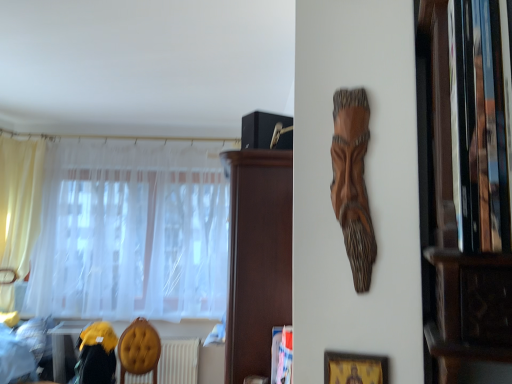
Question: Is yellow sheer curtain at left, which is the second curtain in right-to-left order, not within yellow fabric armchair at lower left?

Choices:
 (A) yes
 (B) no

Answer: (A)

Question: From the image's perspective, is yellow sheer curtain at left, which appears as the 1th curtain when viewed from the left, beneath yellow fabric armchair at lower left?

Choices:
 (A) no
 (B) yes

Answer: (A)

Question: Is yellow sheer curtain at left, which is the second curtain in right-to-left order, oriented towards yellow fabric armchair at lower left?

Choices:
 (A) no
 (B) yes

Answer: (A)

Question: Is yellow sheer curtain at left, which is the second curtain in right-to-left order, bigger than yellow fabric armchair at lower left?

Choices:
 (A) yes
 (B) no

Answer: (A)

Question: Would you consider yellow sheer curtain at left, which appears as the 1th curtain when viewed from the left, to be distant from yellow fabric armchair at lower left?

Choices:
 (A) no
 (B) yes

Answer: (B)

Question: In terms of width, does wooden carving at upper center look wider or thinner when compared to velvet yellow swivel chair at lower left?

Choices:
 (A) thin
 (B) wide

Answer: (A)

Question: Is wooden carving at upper center bigger or smaller than velvet yellow swivel chair at lower left?

Choices:
 (A) big
 (B) small

Answer: (B)

Question: Is wooden carving at upper center taller or shorter than velvet yellow swivel chair at lower left?

Choices:
 (A) short
 (B) tall

Answer: (A)

Question: From a real-world perspective, is wooden carving at upper center positioned above or below velvet yellow swivel chair at lower left?

Choices:
 (A) above
 (B) below

Answer: (A)

Question: Relative to white sheer curtain at left, arranged as the 2th curtain when viewed from the left, is wooden carving at upper center in front or behind?

Choices:
 (A) front
 (B) behind

Answer: (A)

Question: Is wooden carving at upper center inside or outside of white sheer curtain at left, arranged as the 2th curtain when viewed from the left?

Choices:
 (A) inside
 (B) outside

Answer: (B)

Question: From their relative heights in the image, would you say wooden carving at upper center is taller or shorter than white sheer curtain at left, the 1th curtain positioned from the right?

Choices:
 (A) short
 (B) tall

Answer: (A)

Question: Considering the positions of point (358, 105) and point (64, 274), is point (358, 105) closer or farther from the camera than point (64, 274)?

Choices:
 (A) farther
 (B) closer

Answer: (B)

Question: Visually, is white textured radiator at lower center positioned to the left or to the right of dark brown wood cabinet at upper center?

Choices:
 (A) right
 (B) left

Answer: (B)

Question: Considering the positions of white textured radiator at lower center and dark brown wood cabinet at upper center in the image, is white textured radiator at lower center wider or thinner than dark brown wood cabinet at upper center?

Choices:
 (A) thin
 (B) wide

Answer: (A)